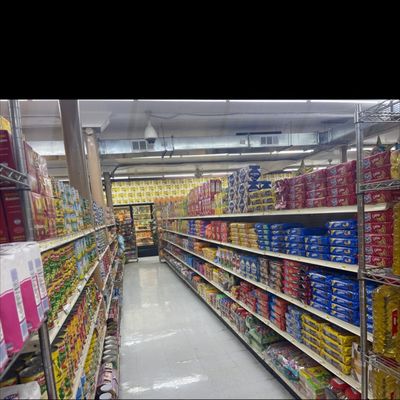
The height and width of the screenshot is (400, 400). I want to click on floor, so click(167, 342).